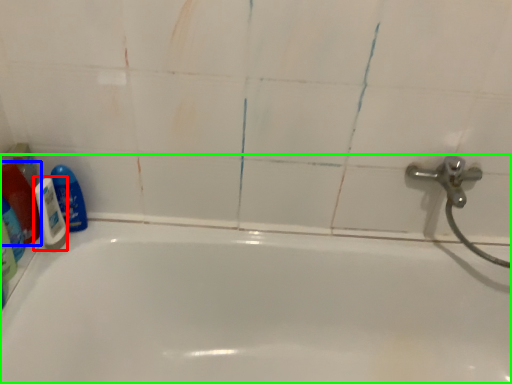
Question: Considering the real-world distances, which object is closest to shaving cream (highlighted by a red box)? cleaning product (highlighted by a blue box) or bathtub (highlighted by a green box).

Choices:
 (A) cleaning product
 (B) bathtub

Answer: (A)